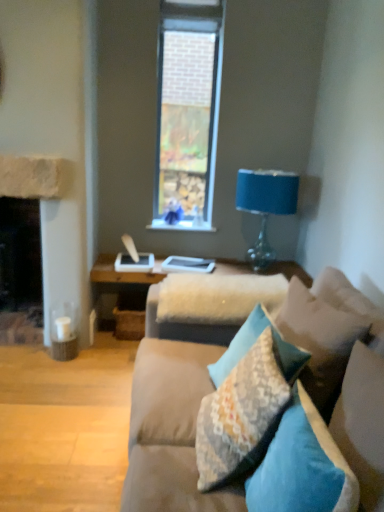
The width and height of the screenshot is (384, 512). I want to click on suede couch at center, so click(170, 429).

You are a GUI agent. You are given a task and a screenshot of the screen. Output one action in this format:
    pyautogui.click(x=<x>, y=<y>)
    Task: Click on the textured cotton pillow at center, which is the 3th pillow from front to back
    
    Given the screenshot: What is the action you would take?
    pyautogui.click(x=241, y=415)

Locate an element on the screen. Image resolution: width=384 pixels, height=512 pixels. brick wall at upper center is located at coordinates (187, 113).

How much space does textured floral pillow at center, placed as the 1th pillow when sorted from back to front, occupy horizontally?

It is 13.05 inches.

The image size is (384, 512). Describe the element at coordinates (362, 423) in the screenshot. I see `teal fabric pillow at center, acting as the second pillow starting from the front` at that location.

The height and width of the screenshot is (512, 384). Describe the element at coordinates (265, 205) in the screenshot. I see `blue fabric-covered lamp at upper right` at that location.

Where is `fuzzy fabric table at center`? This screenshot has width=384, height=512. fuzzy fabric table at center is located at coordinates (118, 287).

Does teal fabric pillow at center, acting as the first pillow starting from the front, contain suede couch at center?

No, suede couch at center is not a part of teal fabric pillow at center, acting as the first pillow starting from the front.

Does point (289, 484) come farther from viewer compared to point (302, 378)?

No.

Relative to fuzzy fabric table at center, is textured cotton pillow at center, which is the 3th pillow from front to back, in front or behind?

textured cotton pillow at center, which is the 3th pillow from front to back, is in front of fuzzy fabric table at center.

Which object is positioned more to the right, textured cotton pillow at center, which is the 3th pillow from front to back, or fuzzy fabric table at center?

Positioned to the right is textured cotton pillow at center, which is the 3th pillow from front to back.

Is point (264, 431) less distant than point (309, 285)?

Yes, it is in front of point (309, 285).

Are textured cotton pillow at center, which is the 3th pillow from front to back, and fuzzy fabric table at center making contact?

textured cotton pillow at center, which is the 3th pillow from front to back, is not next to fuzzy fabric table at center, and they're not touching.

Looking at this image, how many degrees apart are the facing directions of teal fabric pillow at center, acting as the second pillow starting from the front, and teal fabric pillow at center, acting as the first pillow starting from the front?

There is a 0.00309-degree angle between the facing directions of teal fabric pillow at center, acting as the second pillow starting from the front, and teal fabric pillow at center, acting as the first pillow starting from the front.

Consider the image. Is teal fabric pillow at center, placed as the fourth pillow when sorted from back to front, outside of teal fabric pillow at center, placed as the fifth pillow when sorted from back to front?

Yes.

From the image's perspective, is teal fabric pillow at center, acting as the second pillow starting from the front, located above or below teal fabric pillow at center, placed as the fifth pillow when sorted from back to front?

teal fabric pillow at center, acting as the second pillow starting from the front, is situated higher than teal fabric pillow at center, placed as the fifth pillow when sorted from back to front, in the image.

Is teal fabric pillow at center, acting as the second pillow starting from the front, thinner than teal fabric pillow at center, placed as the fifth pillow when sorted from back to front?

Correct, the width of teal fabric pillow at center, acting as the second pillow starting from the front, is less than that of teal fabric pillow at center, placed as the fifth pillow when sorted from back to front.

From a real-world perspective, does teal fabric pillow at center, acting as the first pillow starting from the front, sit lower than blue fabric-covered lamp at upper right?

Yes.

Can you tell me how much teal fabric pillow at center, placed as the fifth pillow when sorted from back to front, and blue fabric-covered lamp at upper right differ in facing direction?

The facing directions of teal fabric pillow at center, placed as the fifth pillow when sorted from back to front, and blue fabric-covered lamp at upper right are 90.4 degrees apart.

Between point (338, 497) and point (290, 177), which one is positioned behind?

The point (290, 177) is farther from the camera.

Is teal fabric pillow at center, placed as the fifth pillow when sorted from back to front, behind blue fabric-covered lamp at upper right?

That is False.

From the image's perspective, is textured floral pillow at center, placed as the 1th pillow when sorted from back to front, under textured beige pillow at lower right, arranged as the 4th pillow when viewed from the front?

Yes, from the image's perspective, textured floral pillow at center, placed as the 1th pillow when sorted from back to front, is below textured beige pillow at lower right, arranged as the 4th pillow when viewed from the front.

How much distance is there between textured floral pillow at center, the fifth pillow positioned from the front, and textured beige pillow at lower right, arranged as the 4th pillow when viewed from the front?

They are 13.48 centimeters apart.

Considering the sizes of objects textured floral pillow at center, the fifth pillow positioned from the front, and textured beige pillow at lower right, arranged as the 4th pillow when viewed from the front, in the image provided, who is wider, textured floral pillow at center, the fifth pillow positioned from the front, or textured beige pillow at lower right, arranged as the 4th pillow when viewed from the front,?

Wider between the two is textured beige pillow at lower right, arranged as the 4th pillow when viewed from the front.

Where is `table located on the left of textured beige pillow at lower right, which is the second pillow from back to front`? The height and width of the screenshot is (512, 384). table located on the left of textured beige pillow at lower right, which is the second pillow from back to front is located at coordinates (118, 287).

Who is bigger, fuzzy fabric table at center or textured beige pillow at lower right, arranged as the 4th pillow when viewed from the front?

Bigger between the two is fuzzy fabric table at center.

From the image's perspective, does fuzzy fabric table at center appear higher than textured beige pillow at lower right, arranged as the 4th pillow when viewed from the front?

Yes.

Locate an element on the screen. studio couch on the right of brick wall at upper center is located at coordinates (170, 429).

Would you say brick wall at upper center is inside or outside suede couch at center?

brick wall at upper center lies outside suede couch at center.

Considering the sizes of objects brick wall at upper center and suede couch at center in the image provided, who is smaller, brick wall at upper center or suede couch at center?

Smaller between the two is brick wall at upper center.

Image resolution: width=384 pixels, height=512 pixels. What are the coordinates of `studio couch on the right side of teal fabric pillow at center, placed as the fifth pillow when sorted from back to front` in the screenshot? It's located at (170, 429).

Identify the location of table to the left of textured cotton pillow at center, which is the 3th pillow from front to back. The image size is (384, 512). (118, 287).

Based on their spatial positions, is fuzzy fabric table at center or suede couch at center further from textured floral pillow at center, placed as the 1th pillow when sorted from back to front?

fuzzy fabric table at center is positioned further to the anchor textured floral pillow at center, placed as the 1th pillow when sorted from back to front.

Which object lies nearer to the anchor point teal fabric pillow at center, acting as the first pillow starting from the front, textured floral pillow at center, placed as the 1th pillow when sorted from back to front, or suede couch at center?

suede couch at center is positioned closer to the anchor teal fabric pillow at center, acting as the first pillow starting from the front.

Estimate the real-world distances between objects in this image. Which object is further from textured beige pillow at lower right, which is the second pillow from back to front, teal fabric pillow at center, acting as the first pillow starting from the front, or suede couch at center?

suede couch at center is positioned further to the anchor textured beige pillow at lower right, which is the second pillow from back to front.

When comparing their distances from suede couch at center, does teal fabric pillow at center, placed as the fourth pillow when sorted from back to front, or blue fabric-covered lamp at upper right seem further?

blue fabric-covered lamp at upper right lies further to suede couch at center than the other object.

Considering their positions, is teal fabric pillow at center, acting as the second pillow starting from the front, positioned closer to brick wall at upper center than textured cotton pillow at center, which is the 3th pillow from front to back?

textured cotton pillow at center, which is the 3th pillow from front to back.

Estimate the real-world distances between objects in this image. Which object is further from teal fabric pillow at center, acting as the second pillow starting from the front, textured cotton pillow at center, which is the 3th pillow from front to back, or textured floral pillow at center, the fifth pillow positioned from the front?

textured floral pillow at center, the fifth pillow positioned from the front, is further to teal fabric pillow at center, acting as the second pillow starting from the front.

From the image, which object appears to be nearer to teal fabric pillow at center, acting as the second pillow starting from the front, textured cotton pillow at center, the third pillow viewed from the back, or fuzzy fabric table at center?

textured cotton pillow at center, the third pillow viewed from the back, is positioned closer to the anchor teal fabric pillow at center, acting as the second pillow starting from the front.

Considering their positions, is textured floral pillow at center, the fifth pillow positioned from the front, positioned further to teal fabric pillow at center, placed as the fourth pillow when sorted from back to front, than teal fabric pillow at center, acting as the first pillow starting from the front?

The object further to teal fabric pillow at center, placed as the fourth pillow when sorted from back to front, is textured floral pillow at center, the fifth pillow positioned from the front.

Identify the location of table lamp between textured floral pillow at center, placed as the 1th pillow when sorted from back to front, and brick wall at upper center from front to back. (265, 205).

Identify the location of pillow located between suede couch at center and teal fabric pillow at center, placed as the fourth pillow when sorted from back to front, in the depth direction. (302, 466).

In order to click on pillow between textured beige pillow at lower right, which is the second pillow from back to front, and fuzzy fabric table at center from front to back in this screenshot , I will do `click(253, 344)`.

Find the location of a particular element. pillow positioned between textured cotton pillow at center, the third pillow viewed from the back, and textured floral pillow at center, the fifth pillow positioned from the front, from near to far is located at coordinates (320, 340).